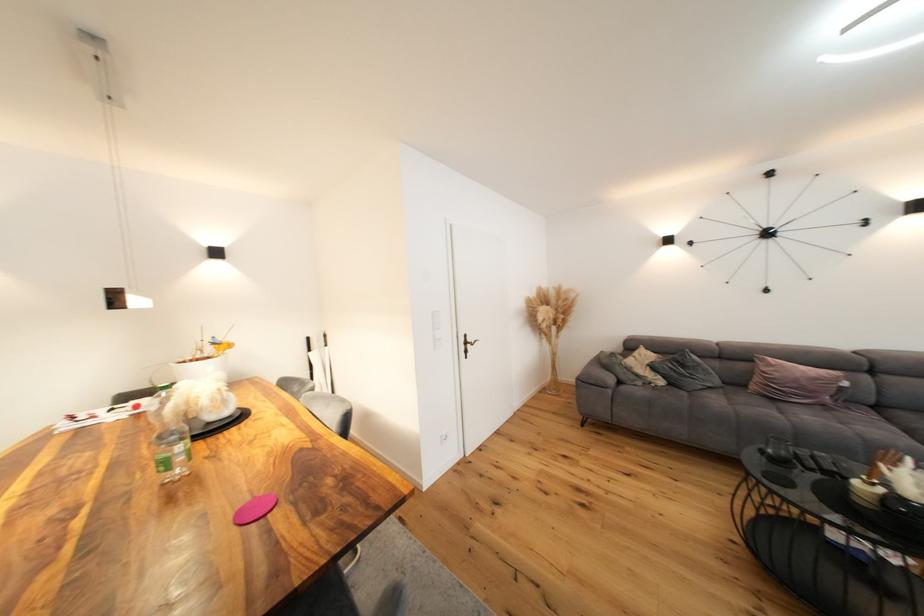
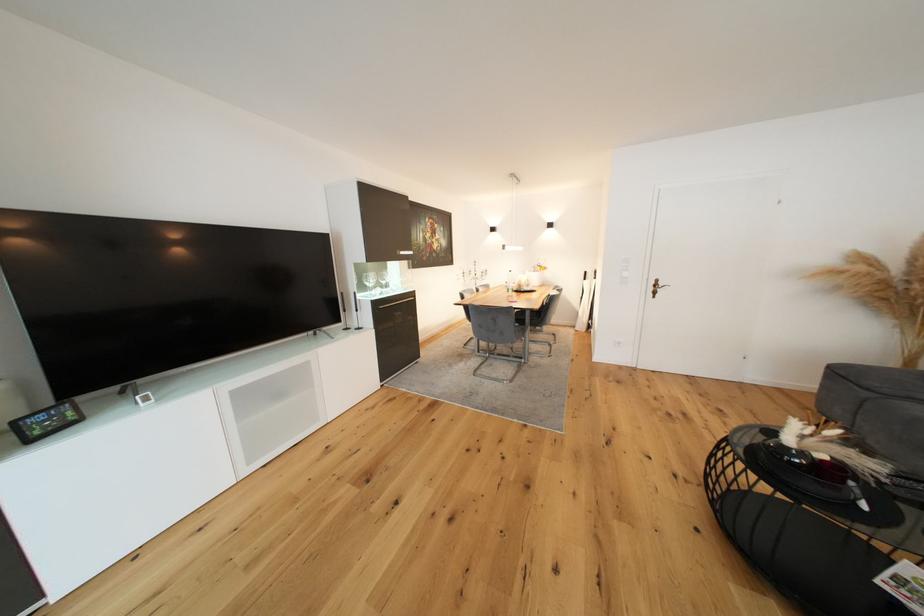
The point at (476,341) is marked in the first image. Where is the corresponding point in the second image?

(667, 286)